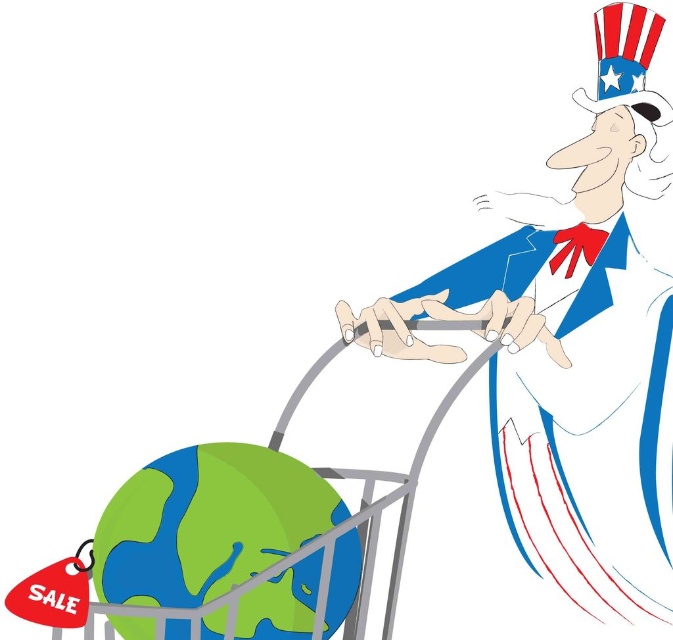
Based on the scene description, which object is bigger between the white paper man at right and the metallic gray trolley at lower left?

The white paper man at right is larger in size than the metallic gray trolley at lower left.

You are an observer standing in front of the image. You notice the green matte globe at lower left and the metallic gray trolley at lower left. Which object takes up more space in the image?

The metallic gray trolley at lower left takes up more space than the green matte globe at lower left because the green matte globe at lower left occupies less space than metallic gray trolley at lower left.

You are a delivery person who needs to place a package on the green matte globe at lower left and the metallic gray trolley at lower left. Which object is closer to you so you can place the package first?

The green matte globe at lower left is closer to you than the metallic gray trolley at lower left, so you can place the package on the green matte globe at lower left first.